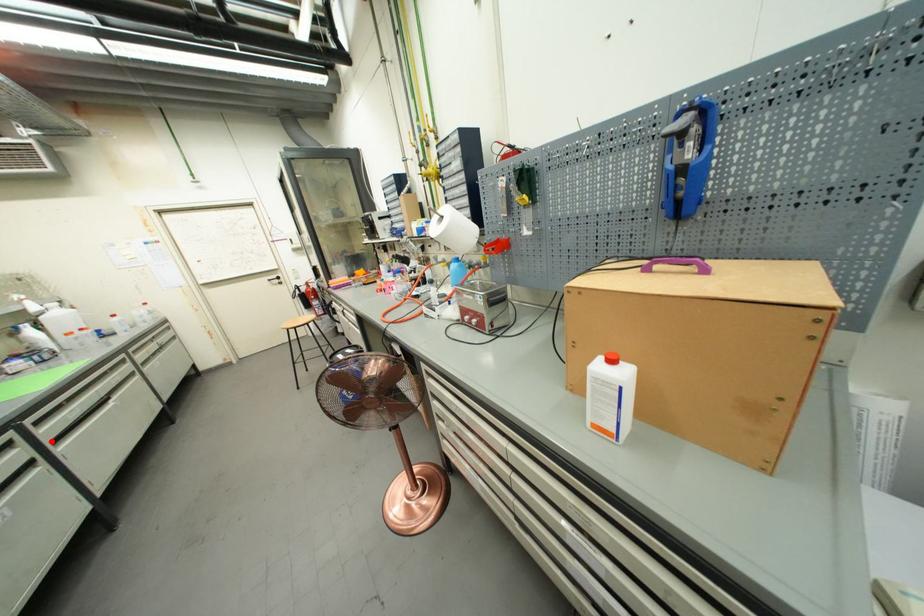
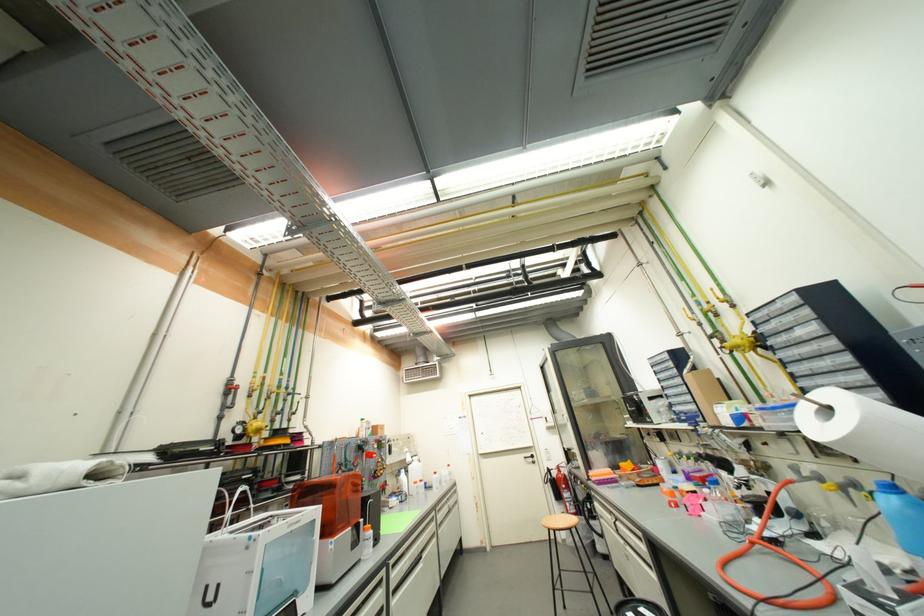
In the second image, find the point that corresponds to the highlighted location in the first image.

(396, 590)